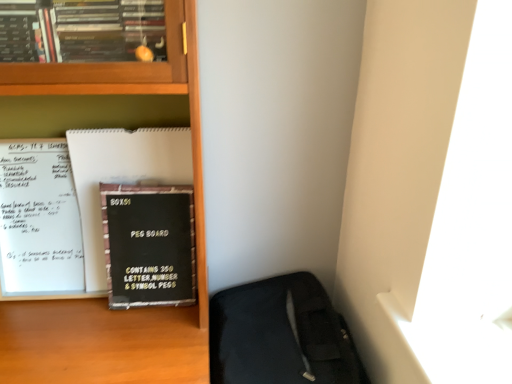
Question: Is the surface of black matte peg board at left in direct contact with black matte peg board at center-left?

Choices:
 (A) no
 (B) yes

Answer: (B)

Question: Is black matte peg board at left shorter than black matte peg board at center-left?

Choices:
 (A) no
 (B) yes

Answer: (A)

Question: From the image's perspective, is black matte peg board at left located above black matte peg board at center-left?

Choices:
 (A) no
 (B) yes

Answer: (B)

Question: Are black matte peg board at left and black matte peg board at center-left far apart?

Choices:
 (A) no
 (B) yes

Answer: (A)

Question: Is black matte peg board at left completely or partially outside of black matte peg board at center-left?

Choices:
 (A) no
 (B) yes

Answer: (B)

Question: From the image's perspective, is black matte peg board at left above or below wooden bookcase at center?

Choices:
 (A) below
 (B) above

Answer: (B)

Question: Considering the positions of black matte peg board at left and wooden bookcase at center in the image, is black matte peg board at left wider or thinner than wooden bookcase at center?

Choices:
 (A) thin
 (B) wide

Answer: (A)

Question: From their relative heights in the image, would you say black matte peg board at left is taller or shorter than wooden bookcase at center?

Choices:
 (A) short
 (B) tall

Answer: (A)

Question: In the image, is black matte peg board at left positioned in front of or behind wooden bookcase at center?

Choices:
 (A) front
 (B) behind

Answer: (B)

Question: Is point (165, 235) closer or farther from the camera than point (316, 350)?

Choices:
 (A) closer
 (B) farther

Answer: (A)

Question: From the image's perspective, is black matte peg board at center-left positioned above or below black fabric sleeping bag at lower right?

Choices:
 (A) below
 (B) above

Answer: (B)

Question: From a real-world perspective, is black matte peg board at center-left above or below black fabric sleeping bag at lower right?

Choices:
 (A) above
 (B) below

Answer: (A)

Question: Is black matte peg board at center-left in front of or behind black fabric sleeping bag at lower right in the image?

Choices:
 (A) behind
 (B) front

Answer: (A)

Question: Would you say wooden bookcase at center is inside or outside black matte peg board at center-left?

Choices:
 (A) outside
 (B) inside

Answer: (A)

Question: Does point (198, 157) appear closer or farther from the camera than point (168, 286)?

Choices:
 (A) farther
 (B) closer

Answer: (B)